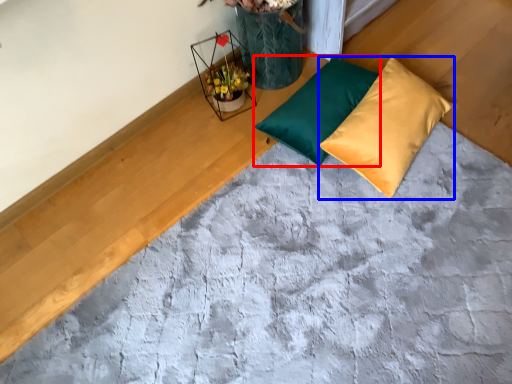
Question: Among these objects, which one is farthest to the camera, pillow (highlighted by a red box) or pillow (highlighted by a blue box)?

Choices:
 (A) pillow
 (B) pillow

Answer: (A)